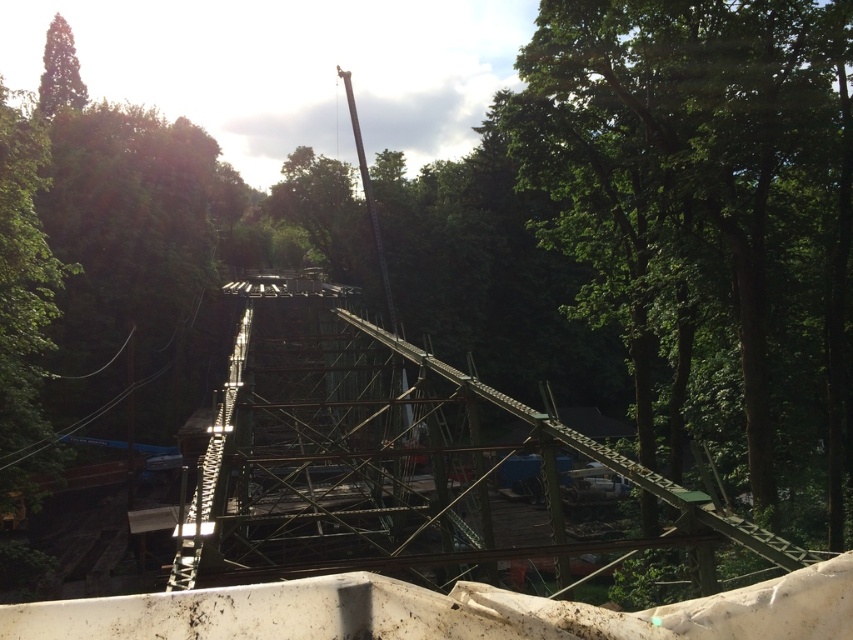
Which of these two, green leafy tree at center or green leafy tree at upper left, stands taller?

Standing taller between the two is green leafy tree at center.

From the picture: Who is lower down, green leafy tree at center or green leafy tree at upper left?

Positioned lower is green leafy tree at center.

Between point (572, 104) and point (73, 90), which one is positioned in front?

Point (572, 104) is more forward.

Identify the location of green leafy tree at center. The height and width of the screenshot is (640, 853). (701, 193).